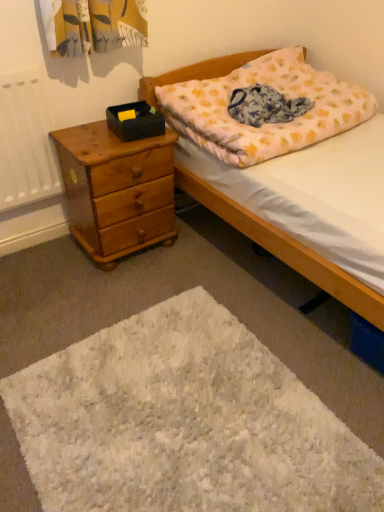
Find the location of a particular element. The image size is (384, 512). empty space that is ontop of light brown wooden chest of drawers at left (from a real-world perspective) is located at coordinates (97, 136).